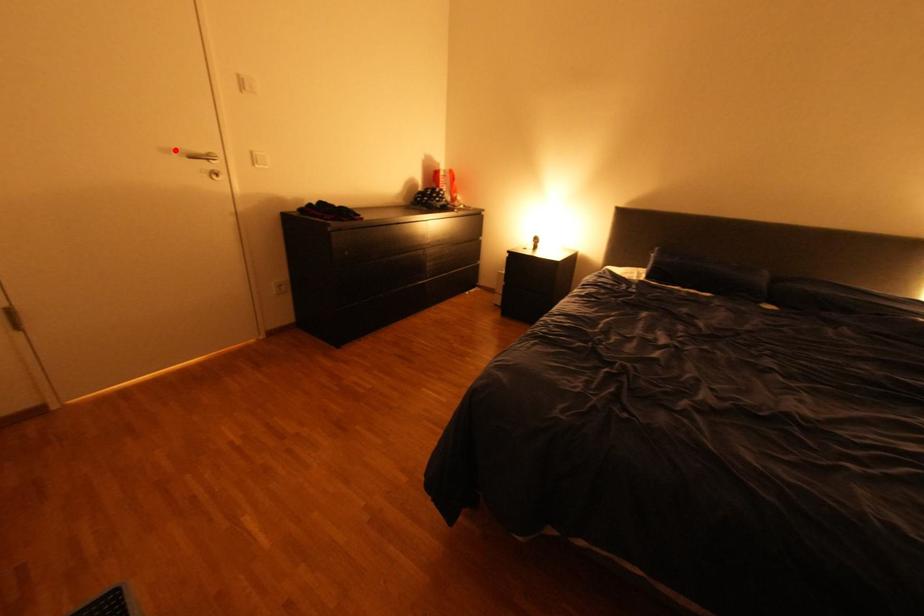
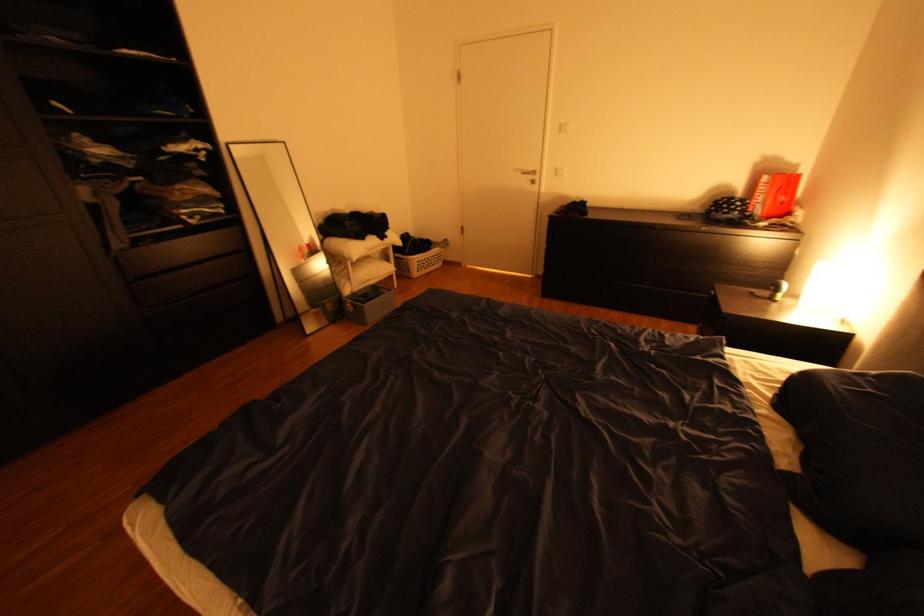
In the second image, find the point that corresponds to the highlighted location in the first image.

(526, 171)